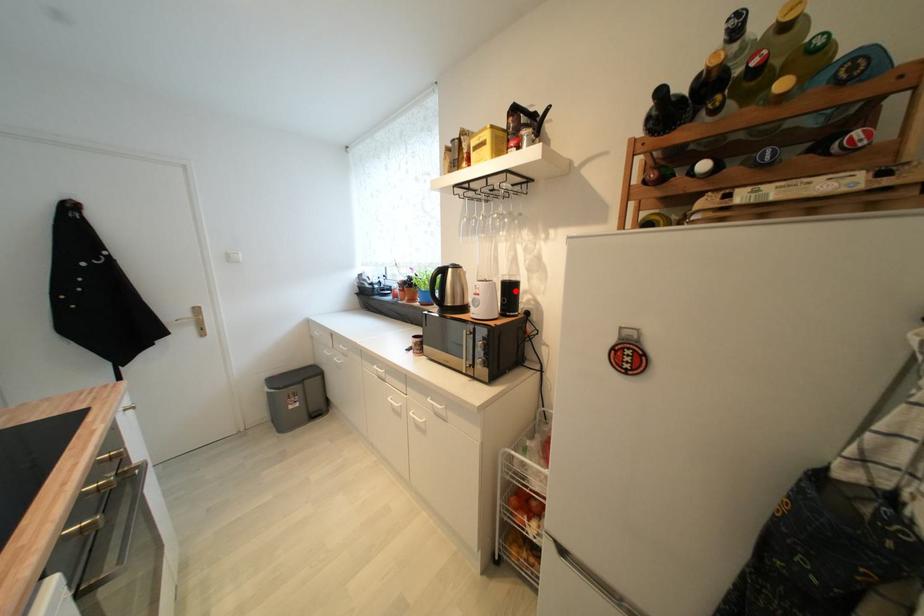
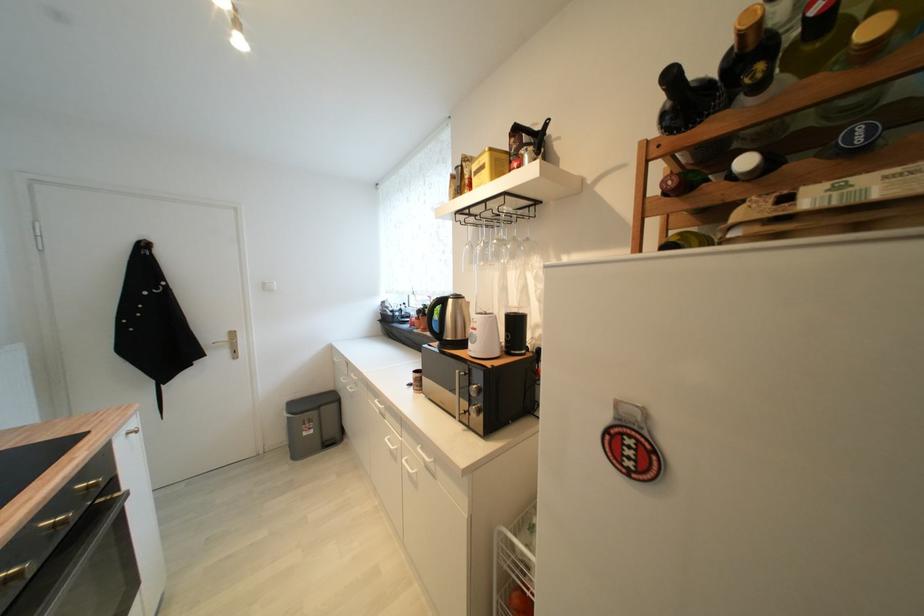
Find the pixel in the second image that matches the highlighted location in the first image.

(521, 325)